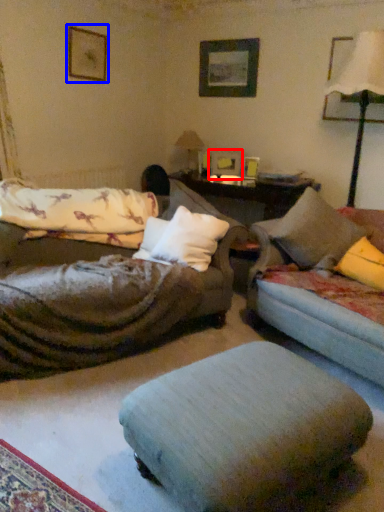
Question: Which object is closer to the camera taking this photo, picture frame (highlighted by a red box) or picture frame (highlighted by a blue box)?

Choices:
 (A) picture frame
 (B) picture frame

Answer: (B)